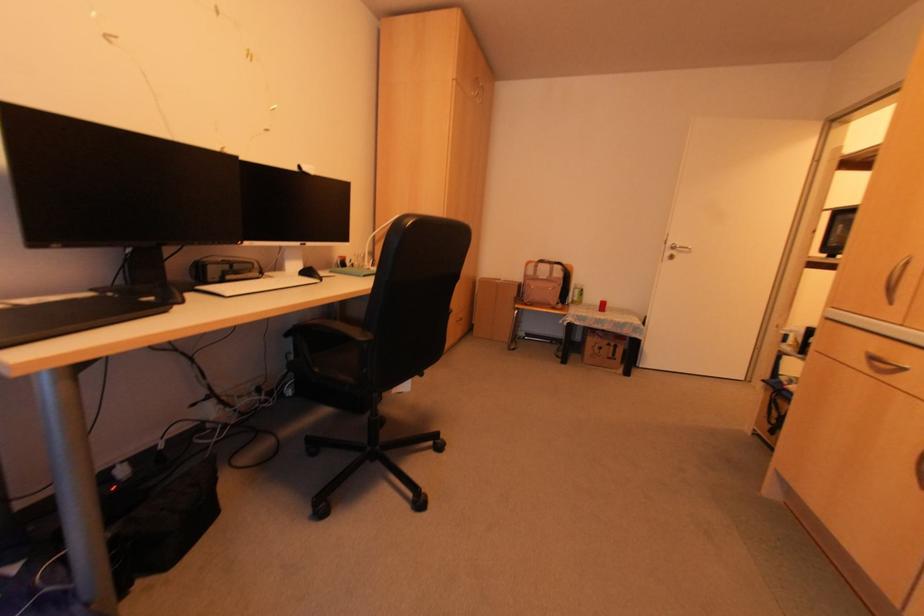
The height and width of the screenshot is (616, 924). I want to click on chair armrest, so click(327, 331).